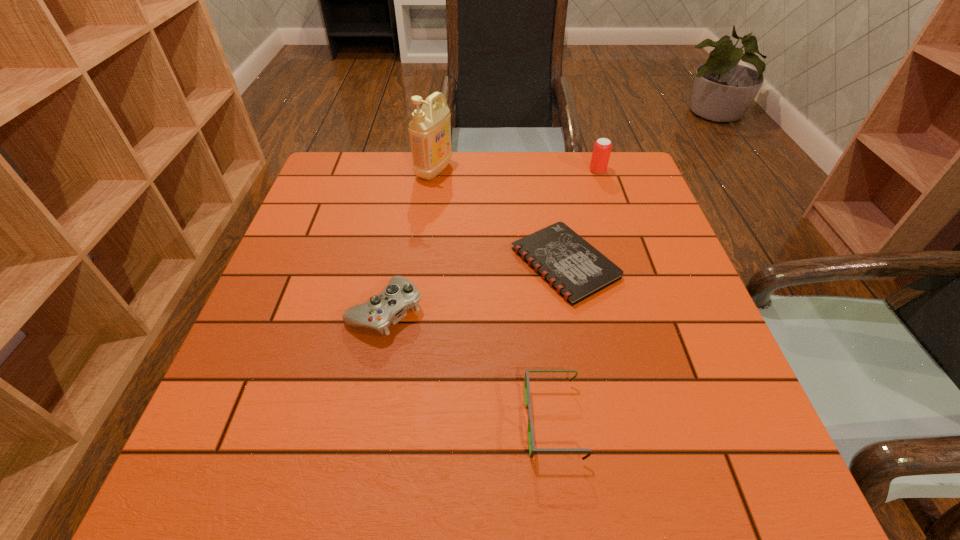
Locate an element on the screen. Image resolution: width=960 pixels, height=540 pixels. vacant space at the far edge of the desktop is located at coordinates (472, 163).

Image resolution: width=960 pixels, height=540 pixels. I want to click on vacant space at the near edge of the desktop, so click(x=566, y=446).

You are a GUI agent. You are given a task and a screenshot of the screen. Output one action in this format:
    pyautogui.click(x=<x>, y=<y>)
    Task: Click on the vacant area at the left edge of the desktop
    Image resolution: width=960 pixels, height=540 pixels.
    Given the screenshot: What is the action you would take?
    pyautogui.click(x=213, y=438)

Find the location of `vacant space at the right edge of the desktop`. vacant space at the right edge of the desktop is located at coordinates (718, 389).

At what (x,y) coordinates should I click in order to perform the action: click on free space at the far right corner of the desktop. Please return your answer as a coordinate pair (x, y). This screenshot has height=540, width=960. Looking at the image, I should click on tap(650, 193).

Find the location of a particular element. The height and width of the screenshot is (540, 960). free space between the shortest object and the control is located at coordinates pyautogui.click(x=475, y=287).

This screenshot has width=960, height=540. What are the coordinates of `free space between the second tallest object and the shortest object` in the screenshot? It's located at (581, 217).

Where is `empty location between the beer can and the notebook`? empty location between the beer can and the notebook is located at coordinates (581, 217).

Identify the location of vacant area that lies between the notebook and the nearest object. This screenshot has width=960, height=540. (559, 342).

In order to click on empty location between the shortest object and the control in this screenshot , I will do `click(475, 287)`.